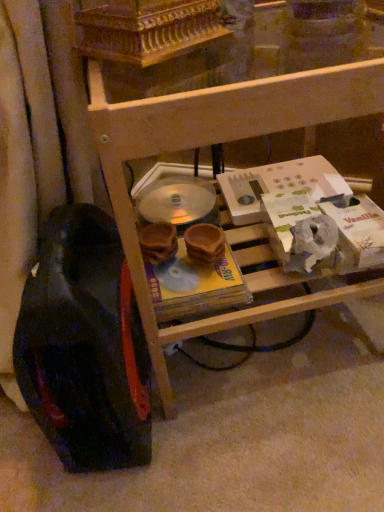
Identify the location of wooden shelf at center. coord(222,141).

The width and height of the screenshot is (384, 512). What do you see at coordinates (222, 141) in the screenshot?
I see `wooden shelf at center` at bounding box center [222, 141].

The width and height of the screenshot is (384, 512). What are the coordinates of `black rubber wheel at lower left` in the screenshot? It's located at (85, 346).

Describe the element at coordinates (85, 346) in the screenshot. I see `black rubber wheel at lower left` at that location.

Measure the distance between point (50,424) and camera.

Point (50,424) is 20.04 inches away from camera.

In order to face black rubber wheel at lower left, should I rotate leftwards or rightwards?

It's best to rotate left around 13.235 degrees.

Measure the distance between black rubber wheel at lower left and camera.

40.18 centimeters.

In order to click on wooden shelf at center in this screenshot , I will do `click(222, 141)`.

Considering the positions of objects black rubber wheel at lower left and wooden shelf at center in the image provided, who is more to the left, black rubber wheel at lower left or wooden shelf at center?

Positioned to the left is black rubber wheel at lower left.

Which object is further away from the camera, black rubber wheel at lower left or wooden shelf at center?

black rubber wheel at lower left is further away from the camera.

Considering the points (131, 449) and (119, 227), which point is behind, point (131, 449) or point (119, 227)?

The point (131, 449) is farther.

From the image's perspective, is black rubber wheel at lower left positioned above or below wooden shelf at center?

black rubber wheel at lower left is below wooden shelf at center.

From a real-world perspective, which is physically above, black rubber wheel at lower left or wooden shelf at center?

wooden shelf at center.

Can you confirm if black rubber wheel at lower left is thinner than wooden shelf at center?

Correct, the width of black rubber wheel at lower left is less than that of wooden shelf at center.

From their relative heights in the image, would you say black rubber wheel at lower left is taller or shorter than wooden shelf at center?

In the image, black rubber wheel at lower left appears to be shorter than wooden shelf at center.

Is black rubber wheel at lower left bigger than wooden shelf at center?

Actually, black rubber wheel at lower left might be smaller than wooden shelf at center.

Is wooden shelf at center completely or partially inside black rubber wheel at lower left?

No, black rubber wheel at lower left does not contain wooden shelf at center.

Are black rubber wheel at lower left and wooden shelf at center far apart?

No.

Is wooden shelf at center at the back of black rubber wheel at lower left?

black rubber wheel at lower left is not turned away from wooden shelf at center.

Can you tell me how much black rubber wheel at lower left and wooden shelf at center differ in facing direction?

80.1 degrees.

Measure the distance from black rubber wheel at lower left to wooden shelf at center.

A distance of 11.41 centimeters exists between black rubber wheel at lower left and wooden shelf at center.

Find the location of a particular element. The image size is (384, 512). furniture above the black rubber wheel at lower left (from a real-world perspective) is located at coordinates (222, 141).

Can you confirm if wooden shelf at center is positioned to the left of black rubber wheel at lower left?

No, wooden shelf at center is not to the left of black rubber wheel at lower left.

Relative to black rubber wheel at lower left, is wooden shelf at center in front or behind?

wooden shelf at center is in front of black rubber wheel at lower left.

Considering the positions of point (379, 105) and point (110, 352), is point (379, 105) closer or farther from the camera than point (110, 352)?

Point (379, 105) is closer to the camera than point (110, 352).

From the image's perspective, which object appears higher, wooden shelf at center or black rubber wheel at lower left?

wooden shelf at center, from the image's perspective.

From a real-world perspective, does wooden shelf at center stand above black rubber wheel at lower left?

Yes, from a real-world perspective, wooden shelf at center is above black rubber wheel at lower left.

Considering the sizes of objects wooden shelf at center and black rubber wheel at lower left in the image provided, who is thinner, wooden shelf at center or black rubber wheel at lower left?

black rubber wheel at lower left.

Considering the sizes of objects wooden shelf at center and black rubber wheel at lower left in the image provided, who is taller, wooden shelf at center or black rubber wheel at lower left?

wooden shelf at center.

In the scene shown: Considering the sizes of objects wooden shelf at center and black rubber wheel at lower left in the image provided, who is bigger, wooden shelf at center or black rubber wheel at lower left?

wooden shelf at center.

Is black rubber wheel at lower left inside wooden shelf at center?

Definitely not — black rubber wheel at lower left is not inside wooden shelf at center.

Is wooden shelf at center next to black rubber wheel at lower left?

No, wooden shelf at center is not next to black rubber wheel at lower left.

Is black rubber wheel at lower left at the back of wooden shelf at center?

No, wooden shelf at center is not facing away from black rubber wheel at lower left.

Can you tell me how much wooden shelf at center and black rubber wheel at lower left differ in facing direction?

They differ by 80.1 degrees in their facing directions.

I want to click on furniture located above the black rubber wheel at lower left (from the image's perspective), so click(222, 141).

Find the location of a particular element. furniture above the black rubber wheel at lower left (from the image's perspective) is located at coordinates (222, 141).

Locate an element on the screen. This screenshot has width=384, height=512. wheel that is under the wooden shelf at center (from a real-world perspective) is located at coordinates (85, 346).